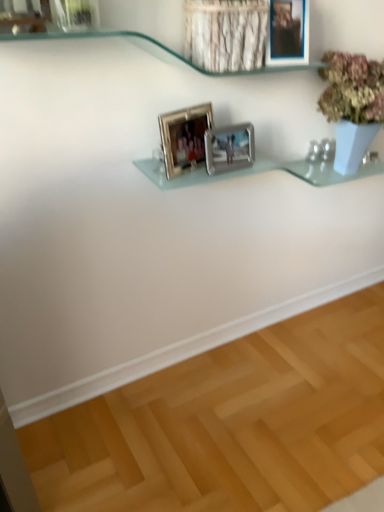
What is the approximate height of metallic silver picture frame at upper center, which ranks as the first picture frame in right-to-left order?

The height of metallic silver picture frame at upper center, which ranks as the first picture frame in right-to-left order, is 9.15 inches.

This screenshot has height=512, width=384. What do you see at coordinates (288, 33) in the screenshot?
I see `metallic silver picture frame at upper center, which is counted as the third picture frame, starting from the left` at bounding box center [288, 33].

At what (x,y) coordinates should I click in order to perform the action: click on clear glass shelf at upper center. Please return your answer as a coordinate pair (x, y). This screenshot has height=512, width=384. Looking at the image, I should click on (158, 40).

Describe the element at coordinates (184, 137) in the screenshot. I see `silver metallic photo frame at center, positioned as the 1th picture frame in left-to-right order` at that location.

What do you see at coordinates (229, 148) in the screenshot?
I see `silver metallic photo frame at center, which appears as the 2th picture frame when viewed from the left` at bounding box center [229, 148].

Identify the location of silver metallic photo frame at center, marked as the second picture frame in a right-to-left arrangement. This screenshot has height=512, width=384. (229, 148).

This screenshot has width=384, height=512. Identify the location of metallic silver picture frame at upper center, which ranks as the first picture frame in right-to-left order. (288, 33).

From a real-world perspective, count 1st picture frames downward from the metallic silver picture frame at upper center, which ranks as the first picture frame in right-to-left order, and point to it. Please provide its 2D coordinates.

[(184, 137)]

Is metallic silver picture frame at upper center, which is counted as the third picture frame, starting from the left, inside or outside of silver metallic photo frame at center, positioned as the 1th picture frame in left-to-right order?

The correct answer is: outside.

Considering the sizes of objects metallic silver picture frame at upper center, which is counted as the third picture frame, starting from the left, and silver metallic photo frame at center, which appears as the third picture frame when viewed from the right, in the image provided, who is wider, metallic silver picture frame at upper center, which is counted as the third picture frame, starting from the left, or silver metallic photo frame at center, which appears as the third picture frame when viewed from the right,?

Wider between the two is metallic silver picture frame at upper center, which is counted as the third picture frame, starting from the left.

Who is smaller, metallic silver picture frame at upper center, which ranks as the first picture frame in right-to-left order, or silver metallic photo frame at center, which appears as the third picture frame when viewed from the right?

silver metallic photo frame at center, which appears as the third picture frame when viewed from the right.

From the image's perspective, would you say clear glass shelf at upper center is shown under metallic silver picture frame at upper center, which is counted as the third picture frame, starting from the left?

Yes, from the image's perspective, clear glass shelf at upper center is below metallic silver picture frame at upper center, which is counted as the third picture frame, starting from the left.

Would you say metallic silver picture frame at upper center, which is counted as the third picture frame, starting from the left, is part of clear glass shelf at upper center's contents?

Yes, metallic silver picture frame at upper center, which is counted as the third picture frame, starting from the left, can be found within clear glass shelf at upper center.

Based on the photo, how many degrees apart are the facing directions of clear glass shelf at upper center and metallic silver picture frame at upper center, which ranks as the first picture frame in right-to-left order?

8.34 degrees.

Considering the relative positions of clear glass shelf at upper center and metallic silver picture frame at upper center, which ranks as the first picture frame in right-to-left order, in the image provided, is clear glass shelf at upper center to the right of metallic silver picture frame at upper center, which ranks as the first picture frame in right-to-left order, from the viewer's perspective?

No, clear glass shelf at upper center is not to the right of metallic silver picture frame at upper center, which ranks as the first picture frame in right-to-left order.

Between silver metallic photo frame at center, marked as the second picture frame in a right-to-left arrangement, and clear glass shelf at upper center, which one has smaller size?

silver metallic photo frame at center, marked as the second picture frame in a right-to-left arrangement.

In the image, is silver metallic photo frame at center, which appears as the 2th picture frame when viewed from the left, positioned in front of or behind clear glass shelf at upper center?

Visually, silver metallic photo frame at center, which appears as the 2th picture frame when viewed from the left, is located behind clear glass shelf at upper center.

Is silver metallic photo frame at center, which appears as the 2th picture frame when viewed from the left, at the left side of clear glass shelf at upper center?

In fact, silver metallic photo frame at center, which appears as the 2th picture frame when viewed from the left, is to the right of clear glass shelf at upper center.

From their relative heights in the image, would you say metallic silver picture frame at upper center, which ranks as the first picture frame in right-to-left order, is taller or shorter than clear glass shelf at upper center?

In the image, metallic silver picture frame at upper center, which ranks as the first picture frame in right-to-left order, appears to be taller than clear glass shelf at upper center.

From a real-world perspective, is metallic silver picture frame at upper center, which ranks as the first picture frame in right-to-left order, below clear glass shelf at upper center?

No, from a real-world perspective, metallic silver picture frame at upper center, which ranks as the first picture frame in right-to-left order, is not beneath clear glass shelf at upper center.

From the image's perspective, is metallic silver picture frame at upper center, which is counted as the third picture frame, starting from the left, located beneath clear glass shelf at upper center?

No, from the image's perspective, metallic silver picture frame at upper center, which is counted as the third picture frame, starting from the left, is not below clear glass shelf at upper center.

Based on the photo, is silver metallic photo frame at center, which appears as the third picture frame when viewed from the right, next to metallic silver picture frame at upper center, which is counted as the third picture frame, starting from the left, and touching it?

silver metallic photo frame at center, which appears as the third picture frame when viewed from the right, is not next to metallic silver picture frame at upper center, which is counted as the third picture frame, starting from the left, and they're not touching.

Is silver metallic photo frame at center, which appears as the third picture frame when viewed from the right, in front of or behind metallic silver picture frame at upper center, which ranks as the first picture frame in right-to-left order, in the image?

In the image, silver metallic photo frame at center, which appears as the third picture frame when viewed from the right, appears behind metallic silver picture frame at upper center, which ranks as the first picture frame in right-to-left order.

From a real-world perspective, is silver metallic photo frame at center, which appears as the third picture frame when viewed from the right, positioned over metallic silver picture frame at upper center, which is counted as the third picture frame, starting from the left, based on gravity?

Actually, silver metallic photo frame at center, which appears as the third picture frame when viewed from the right, is physically below metallic silver picture frame at upper center, which is counted as the third picture frame, starting from the left, in the real world.

Which of these two, silver metallic photo frame at center, which appears as the third picture frame when viewed from the right, or metallic silver picture frame at upper center, which is counted as the third picture frame, starting from the left, is smaller?

Smaller between the two is silver metallic photo frame at center, which appears as the third picture frame when viewed from the right.

In terms of width, does silver metallic photo frame at center, marked as the second picture frame in a right-to-left arrangement, look wider or thinner when compared to silver metallic photo frame at center, which appears as the third picture frame when viewed from the right?

Clearly, silver metallic photo frame at center, marked as the second picture frame in a right-to-left arrangement, has less width compared to silver metallic photo frame at center, which appears as the third picture frame when viewed from the right.

From a real-world perspective, between silver metallic photo frame at center, marked as the second picture frame in a right-to-left arrangement, and silver metallic photo frame at center, which appears as the third picture frame when viewed from the right, who is vertically higher?

In real-world perspective, silver metallic photo frame at center, which appears as the third picture frame when viewed from the right, is above.

Considering the sizes of objects silver metallic photo frame at center, which appears as the 2th picture frame when viewed from the left, and silver metallic photo frame at center, positioned as the 1th picture frame in left-to-right order, in the image provided, who is smaller, silver metallic photo frame at center, which appears as the 2th picture frame when viewed from the left, or silver metallic photo frame at center, positioned as the 1th picture frame in left-to-right order,?

Smaller between the two is silver metallic photo frame at center, which appears as the 2th picture frame when viewed from the left.

From the image's perspective, is silver metallic photo frame at center, which appears as the 2th picture frame when viewed from the left, located above silver metallic photo frame at center, positioned as the 1th picture frame in left-to-right order?

Actually, silver metallic photo frame at center, which appears as the 2th picture frame when viewed from the left, appears below silver metallic photo frame at center, positioned as the 1th picture frame in left-to-right order, in the image.

From the image's perspective, is silver metallic photo frame at center, marked as the second picture frame in a right-to-left arrangement, located above metallic silver picture frame at upper center, which ranks as the first picture frame in right-to-left order?

No, from the image's perspective, silver metallic photo frame at center, marked as the second picture frame in a right-to-left arrangement, is not over metallic silver picture frame at upper center, which ranks as the first picture frame in right-to-left order.

Can you confirm if silver metallic photo frame at center, which appears as the 2th picture frame when viewed from the left, is bigger than metallic silver picture frame at upper center, which ranks as the first picture frame in right-to-left order?

No.

This screenshot has width=384, height=512. What are the coordinates of `the 2nd picture frame in front when counting from the silver metallic photo frame at center, marked as the second picture frame in a right-to-left arrangement` in the screenshot? It's located at (288, 33).

Is silver metallic photo frame at center, marked as the second picture frame in a right-to-left arrangement, oriented towards metallic silver picture frame at upper center, which is counted as the third picture frame, starting from the left?

No, silver metallic photo frame at center, marked as the second picture frame in a right-to-left arrangement, is not oriented towards metallic silver picture frame at upper center, which is counted as the third picture frame, starting from the left.

You are a GUI agent. You are given a task and a screenshot of the screen. Output one action in this format:
    pyautogui.click(x=<x>, y=<y>)
    Task: Click on the picture frame above the silver metallic photo frame at center, positioned as the 1th picture frame in left-to-right order (from the image's perspective)
    The image size is (384, 512).
    Given the screenshot: What is the action you would take?
    pyautogui.click(x=288, y=33)

Where is `shelf that is in front of the metallic silver picture frame at upper center, which is counted as the third picture frame, starting from the left`? The width and height of the screenshot is (384, 512). shelf that is in front of the metallic silver picture frame at upper center, which is counted as the third picture frame, starting from the left is located at coordinates (158, 40).

Which object lies nearer to the anchor point silver metallic photo frame at center, which appears as the third picture frame when viewed from the right, silver metallic photo frame at center, which appears as the 2th picture frame when viewed from the left, or clear glass shelf at upper center?

silver metallic photo frame at center, which appears as the 2th picture frame when viewed from the left, is closer to silver metallic photo frame at center, which appears as the third picture frame when viewed from the right.

From the image, which object appears to be farther from silver metallic photo frame at center, marked as the second picture frame in a right-to-left arrangement, clear glass shelf at upper center or silver metallic photo frame at center, which appears as the third picture frame when viewed from the right?

clear glass shelf at upper center.

Considering their positions, is silver metallic photo frame at center, positioned as the 1th picture frame in left-to-right order, positioned closer to metallic silver picture frame at upper center, which is counted as the third picture frame, starting from the left, than silver metallic photo frame at center, which appears as the 2th picture frame when viewed from the left?

silver metallic photo frame at center, which appears as the 2th picture frame when viewed from the left, is closer to metallic silver picture frame at upper center, which is counted as the third picture frame, starting from the left.

Consider the image. Looking at the image, which one is located closer to metallic silver picture frame at upper center, which is counted as the third picture frame, starting from the left, silver metallic photo frame at center, which appears as the third picture frame when viewed from the right, or clear glass shelf at upper center?

Based on the image, clear glass shelf at upper center appears to be nearer to metallic silver picture frame at upper center, which is counted as the third picture frame, starting from the left.

Which object lies further to the anchor point clear glass shelf at upper center, metallic silver picture frame at upper center, which is counted as the third picture frame, starting from the left, or silver metallic photo frame at center, which appears as the 2th picture frame when viewed from the left?

Based on the image, silver metallic photo frame at center, which appears as the 2th picture frame when viewed from the left, appears to be further to clear glass shelf at upper center.

Considering their positions, is silver metallic photo frame at center, marked as the second picture frame in a right-to-left arrangement, positioned closer to metallic silver picture frame at upper center, which is counted as the third picture frame, starting from the left, than silver metallic photo frame at center, positioned as the 1th picture frame in left-to-right order?

The object closer to metallic silver picture frame at upper center, which is counted as the third picture frame, starting from the left, is silver metallic photo frame at center, marked as the second picture frame in a right-to-left arrangement.

Consider the image. Which object lies further to the anchor point silver metallic photo frame at center, which appears as the third picture frame when viewed from the right, metallic silver picture frame at upper center, which is counted as the third picture frame, starting from the left, or clear glass shelf at upper center?

Based on the image, metallic silver picture frame at upper center, which is counted as the third picture frame, starting from the left, appears to be further to silver metallic photo frame at center, which appears as the third picture frame when viewed from the right.

Based on their spatial positions, is clear glass shelf at upper center or silver metallic photo frame at center, which appears as the 2th picture frame when viewed from the left, closer to silver metallic photo frame at center, positioned as the 1th picture frame in left-to-right order?

silver metallic photo frame at center, which appears as the 2th picture frame when viewed from the left.

I want to click on picture frame between metallic silver picture frame at upper center, which is counted as the third picture frame, starting from the left, and silver metallic photo frame at center, which appears as the 2th picture frame when viewed from the left, in the up-down direction, so click(184, 137).